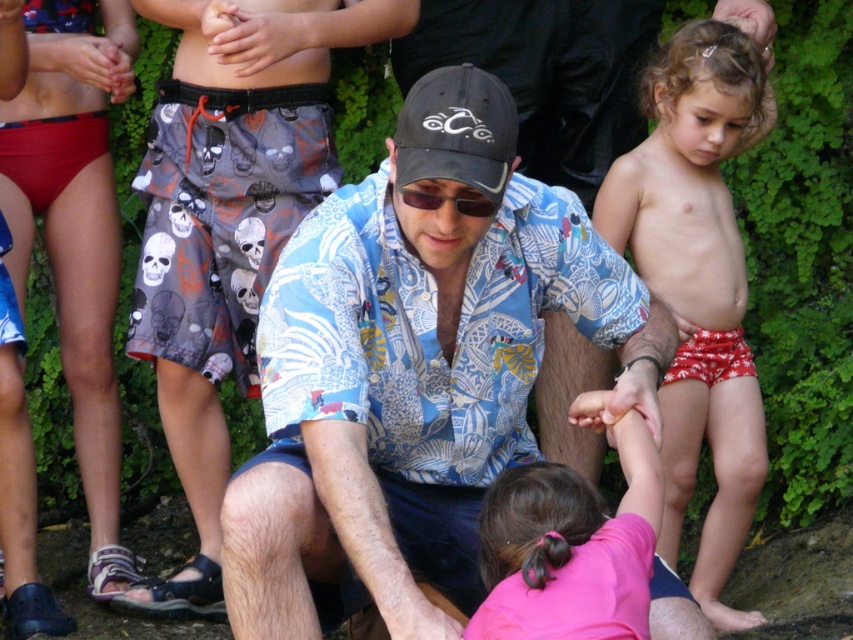
You are a photographer trying to capture a candid shot of the red printed shorts at right. Based on their position in the image, what coordinates should you aim your camera at to center the shorts in your viewfinder?

The red printed shorts at right are located at coordinates point (698, 284), so you should aim your camera at those coordinates to center them in your viewfinder.

You are standing at the center of the image and want to find the pink fabric shirt at lower center. According to the coordinates provided, in which direction should you look to locate it?

The pink fabric shirt at lower center is located at point (569, 548), which means you should look towards the lower right direction from the center to find it.